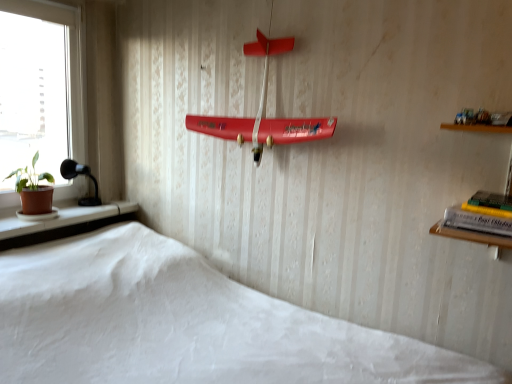
What do you see at coordinates (33, 189) in the screenshot?
I see `green matte houseplant at left` at bounding box center [33, 189].

The width and height of the screenshot is (512, 384). What do you see at coordinates (184, 323) in the screenshot?
I see `white matte bed at lower center` at bounding box center [184, 323].

Where is `green matte houseplant at left`? Image resolution: width=512 pixels, height=384 pixels. green matte houseplant at left is located at coordinates (33, 189).

In the image, is green matte houseplant at left on the left side or the right side of terracotta clay pot at left?

From the image, it's evident that green matte houseplant at left is to the left of terracotta clay pot at left.

Are green matte houseplant at left and terracotta clay pot at left beside each other?

No, green matte houseplant at left is not with terracotta clay pot at left.

Considering the relative sizes of green matte houseplant at left and terracotta clay pot at left in the image provided, is green matte houseplant at left thinner than terracotta clay pot at left?

Correct, the width of green matte houseplant at left is less than that of terracotta clay pot at left.

Is green matte houseplant at left aimed at terracotta clay pot at left?

No, green matte houseplant at left is not aimed at terracotta clay pot at left.

I want to click on window sill lying below the hardcover book at right (from the image's perspective), so click(64, 224).

Between hardcover book at right and terracotta clay pot at left, which one appears on the left side from the viewer's perspective?

terracotta clay pot at left.

Is hardcover book at right far away from terracotta clay pot at left?

That's right, there is a large distance between hardcover book at right and terracotta clay pot at left.

Considering the points (503, 235) and (64, 244), which point is behind, point (503, 235) or point (64, 244)?

The point (64, 244) is farther.

Consider the image. Is hardcover book at right in contact with white matte bed at lower center?

hardcover book at right and white matte bed at lower center are clearly separated.

Which object is closer to the camera taking this photo, hardcover book at right or white matte bed at lower center?

white matte bed at lower center is closer to the camera.

Is hardcover book at right not inside white matte bed at lower center?

Indeed, hardcover book at right is completely outside white matte bed at lower center.

Does green matte houseplant at left have a smaller size compared to white matte bed at lower center?

Correct, green matte houseplant at left occupies less space than white matte bed at lower center.

Which of these two, green matte houseplant at left or white matte bed at lower center, is wider?

white matte bed at lower center.

Would you say green matte houseplant at left is to the left or to the right of white matte bed at lower center in the picture?

Based on their positions, green matte houseplant at left is located to the left of white matte bed at lower center.

Does terracotta clay pot at left turn towards green matte houseplant at left?

No, terracotta clay pot at left is not facing towards green matte houseplant at left.

Which object is more forward, terracotta clay pot at left or green matte houseplant at left?

terracotta clay pot at left is closer to the camera.

At what (x,y) coordinates should I click in order to perform the action: click on houseplant on the left of the terracotta clay pot at left. Please return your answer as a coordinate pair (x, y). The height and width of the screenshot is (384, 512). Looking at the image, I should click on (33, 189).

Is terracotta clay pot at left taller or shorter than green matte houseplant at left?

terracotta clay pot at left is shorter than green matte houseplant at left.

Is terracotta clay pot at left positioned with its back to white matte bed at lower center?

terracotta clay pot at left does not have its back to white matte bed at lower center.

Is terracotta clay pot at left not inside white matte bed at lower center?

Yes, terracotta clay pot at left is outside of white matte bed at lower center.

From a real-world perspective, is terracotta clay pot at left positioned above or below white matte bed at lower center?

terracotta clay pot at left is situated higher than white matte bed at lower center in the real world.

Which of these two, terracotta clay pot at left or white matte bed at lower center, stands shorter?

With less height is terracotta clay pot at left.

Between hardcover book at right and green matte houseplant at left, which one is positioned behind?

green matte houseplant at left is further from the camera.

Can you confirm if hardcover book at right is taller than green matte houseplant at left?

No, hardcover book at right is not taller than green matte houseplant at left.

Which of these two, hardcover book at right or green matte houseplant at left, is smaller?

hardcover book at right is smaller.

Can you confirm if hardcover book at right is thinner than green matte houseplant at left?

In fact, hardcover book at right might be wider than green matte houseplant at left.

The height and width of the screenshot is (384, 512). In order to click on houseplant above the terracotta clay pot at left (from a real-world perspective) in this screenshot , I will do `click(33, 189)`.

This screenshot has height=384, width=512. I want to click on book lying on the right of terracotta clay pot at left, so click(x=482, y=214).

From the image, which object appears to be nearer to black glass lamp at left, hardcover book at right or green matte houseplant at left?

green matte houseplant at left is closer to black glass lamp at left.

Which object lies nearer to the anchor point black glass lamp at left, terracotta clay pot at left or hardcover book at right?

The object closer to black glass lamp at left is terracotta clay pot at left.

When comparing their distances from hardcover book at right, does terracotta clay pot at left or white matte bed at lower center seem further?

terracotta clay pot at left lies further to hardcover book at right than the other object.

Based on their spatial positions, is hardcover book at right or white matte bed at lower center closer to black glass lamp at left?

white matte bed at lower center is closer to black glass lamp at left.

When comparing their distances from terracotta clay pot at left, does black glass lamp at left or green matte houseplant at left seem further?

black glass lamp at left is positioned further to the anchor terracotta clay pot at left.

From the image, which object appears to be farther from terracotta clay pot at left, green matte houseplant at left or white matte bed at lower center?

Based on the image, white matte bed at lower center appears to be further to terracotta clay pot at left.

Estimate the real-world distances between objects in this image. Which object is closer to white matte bed at lower center, hardcover book at right or terracotta clay pot at left?

The object closer to white matte bed at lower center is terracotta clay pot at left.

Estimate the real-world distances between objects in this image. Which object is further from black glass lamp at left, green matte houseplant at left or terracotta clay pot at left?

The object further to black glass lamp at left is terracotta clay pot at left.

The height and width of the screenshot is (384, 512). In order to click on houseplant between white matte bed at lower center and black glass lamp at left from front to back in this screenshot , I will do `click(33, 189)`.

Find the location of a particular element. This screenshot has height=384, width=512. lamp between green matte houseplant at left and hardcover book at right is located at coordinates (76, 176).

Locate an element on the screen. bed between terracotta clay pot at left and hardcover book at right in the horizontal direction is located at coordinates (184, 323).

I want to click on window sill between white matte bed at lower center and green matte houseplant at left in the front-back direction, so click(x=64, y=224).